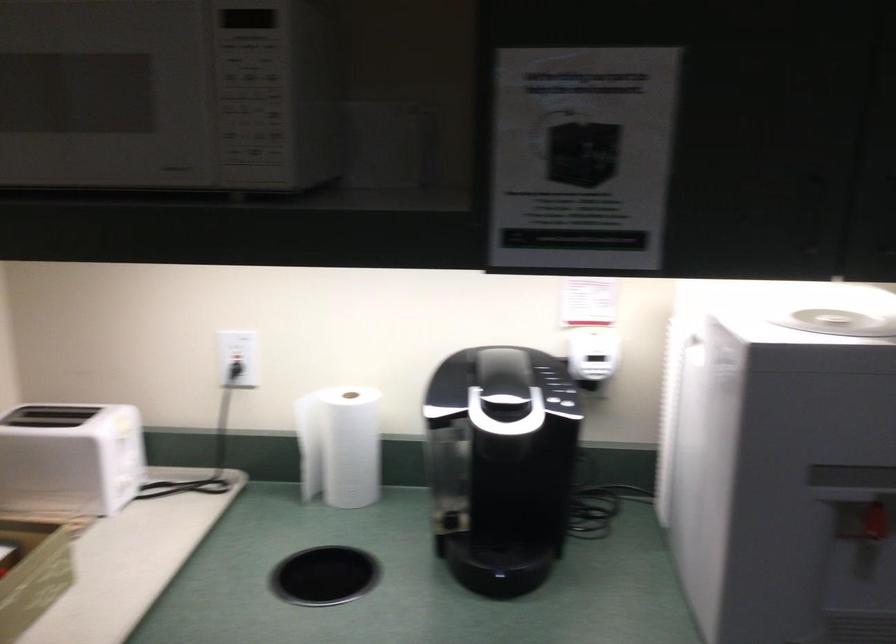
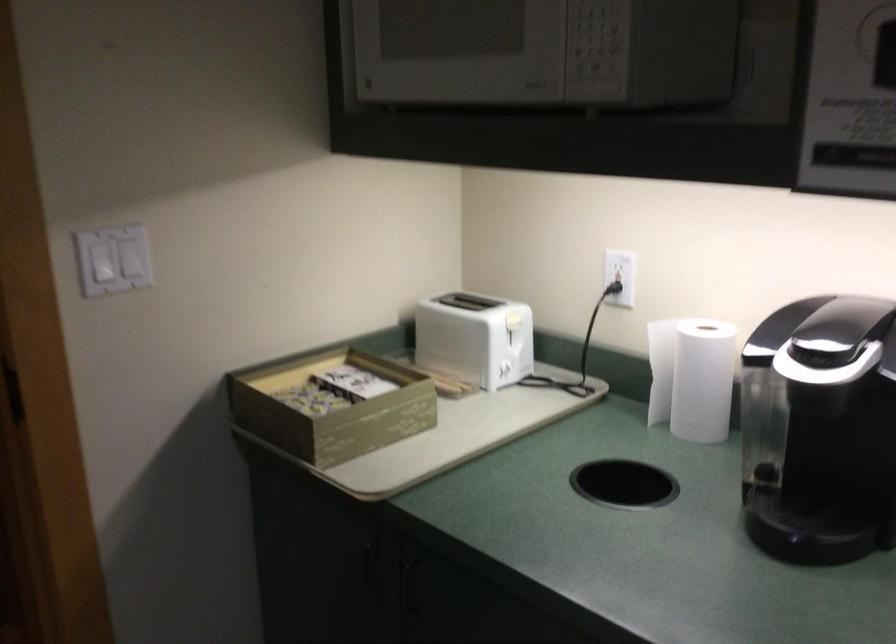
Question: The camera is either moving clockwise (left) or counter-clockwise (right) around the object. The first image is from the beginning of the video and the second image is from the end. Is the camera moving left or right when shooting the video?

Choices:
 (A) Left
 (B) Right

Answer: (B)